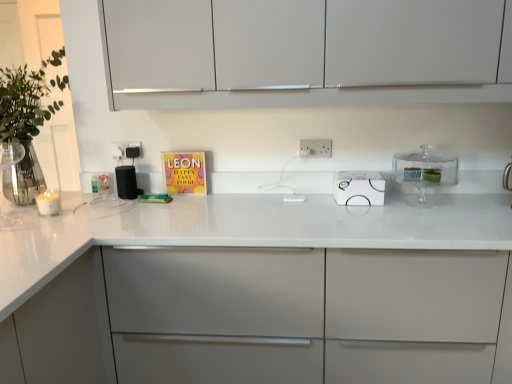
Question: Can you confirm if white plastic electric outlet at center, which is the first electric outlet in left-to-right order, is positioned to the left of white glossy electric stove at center?

Choices:
 (A) no
 (B) yes

Answer: (B)

Question: Considering the relative sizes of white plastic electric outlet at center, which is the first electric outlet in left-to-right order, and white glossy electric stove at center in the image provided, is white plastic electric outlet at center, which is the first electric outlet in left-to-right order, wider than white glossy electric stove at center?

Choices:
 (A) yes
 (B) no

Answer: (B)

Question: Is white plastic electric outlet at center, the 2th electric outlet when ordered from right to left, taller than white glossy electric stove at center?

Choices:
 (A) yes
 (B) no

Answer: (B)

Question: Is white plastic electric outlet at center, the 2th electric outlet when ordered from right to left, not within white glossy electric stove at center?

Choices:
 (A) yes
 (B) no

Answer: (A)

Question: Is white plastic electric outlet at center, which is the first electric outlet in left-to-right order, oriented towards white glossy electric stove at center?

Choices:
 (A) yes
 (B) no

Answer: (B)

Question: From a real-world perspective, is white plastic electric outlet at center, which is the first electric outlet in left-to-right order, physically below white glossy electric stove at center?

Choices:
 (A) no
 (B) yes

Answer: (A)

Question: Does green leafy plant at left have a smaller size compared to matte colorful book at center?

Choices:
 (A) yes
 (B) no

Answer: (B)

Question: Can matte colorful book at center be found inside green leafy plant at left?

Choices:
 (A) no
 (B) yes

Answer: (A)

Question: Considering the relative sizes of green leafy plant at left and matte colorful book at center in the image provided, is green leafy plant at left bigger than matte colorful book at center?

Choices:
 (A) yes
 (B) no

Answer: (A)

Question: Can you see green leafy plant at left touching matte colorful book at center?

Choices:
 (A) yes
 (B) no

Answer: (B)

Question: From the image's perspective, is green leafy plant at left beneath matte colorful book at center?

Choices:
 (A) no
 (B) yes

Answer: (A)

Question: Can you confirm if green leafy plant at left is thinner than matte colorful book at center?

Choices:
 (A) no
 (B) yes

Answer: (A)

Question: Does black matte speaker at center come behind white matte cabinet at center, marked as the 1th cabinetry in a bottom-to-top arrangement?

Choices:
 (A) no
 (B) yes

Answer: (B)